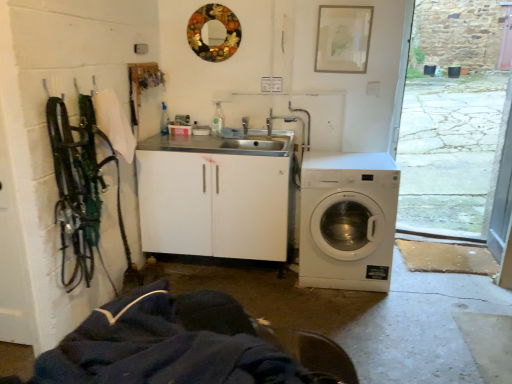
Locate an element on the screen. The image size is (512, 384). white plastic washing machine at lower right is located at coordinates (348, 220).

What do you see at coordinates (348, 220) in the screenshot? I see `white plastic washing machine at lower right` at bounding box center [348, 220].

Describe the element at coordinates (220, 22) in the screenshot. I see `metallic circular mirror at upper center` at that location.

Image resolution: width=512 pixels, height=384 pixels. What are the coordinates of `metallic circular mirror at upper center` in the screenshot? It's located at (220, 22).

Identify the location of white plastic washing machine at lower right. The width and height of the screenshot is (512, 384). (348, 220).

Between white plastic washing machine at lower right and metallic circular mirror at upper center, which one appears on the right side from the viewer's perspective?

From the viewer's perspective, white plastic washing machine at lower right appears more on the right side.

Does white plastic washing machine at lower right come behind metallic circular mirror at upper center?

That is False.

Does point (312, 239) come closer to viewer compared to point (229, 29)?

Yes, it is.

From the image's perspective, is white plastic washing machine at lower right located beneath metallic circular mirror at upper center?

Indeed, from the image's perspective, white plastic washing machine at lower right is shown beneath metallic circular mirror at upper center.

From a real-world perspective, is white plastic washing machine at lower right physically above metallic circular mirror at upper center?

No, from a real-world perspective, white plastic washing machine at lower right is not above metallic circular mirror at upper center.

In terms of width, does white plastic washing machine at lower right look wider or thinner when compared to metallic circular mirror at upper center?

white plastic washing machine at lower right is wider than metallic circular mirror at upper center.

Can you confirm if white plastic washing machine at lower right is taller than metallic circular mirror at upper center?

Correct, white plastic washing machine at lower right is much taller as metallic circular mirror at upper center.

From the picture: Which of these two, white plastic washing machine at lower right or metallic circular mirror at upper center, is smaller?

With smaller size is metallic circular mirror at upper center.

Can metallic circular mirror at upper center be found inside white plastic washing machine at lower right?

No, metallic circular mirror at upper center is located outside of white plastic washing machine at lower right.

Would you say white plastic washing machine at lower right is a long distance from metallic circular mirror at upper center?

Indeed, white plastic washing machine at lower right is not near metallic circular mirror at upper center.

Is white plastic washing machine at lower right looking in the opposite direction of metallic circular mirror at upper center?

No, white plastic washing machine at lower right is not facing away from metallic circular mirror at upper center.

How different are the orientations of white plastic washing machine at lower right and metallic circular mirror at upper center in degrees?

There is a 3.11-degree angle between the facing directions of white plastic washing machine at lower right and metallic circular mirror at upper center.

The height and width of the screenshot is (384, 512). I want to click on mirror behind the white plastic washing machine at lower right, so click(220, 22).

Visually, is metallic circular mirror at upper center positioned to the left or to the right of white plastic washing machine at lower right?

metallic circular mirror at upper center is positioned on white plastic washing machine at lower right's left side.

Which object is further away from the camera taking this photo, metallic circular mirror at upper center or white plastic washing machine at lower right?

metallic circular mirror at upper center is further from the camera.

Which is further, (198,17) or (336,248)?

The point (198,17) is more distant.

From the image's perspective, is metallic circular mirror at upper center over white plastic washing machine at lower right?

Yes.

From a real-world perspective, is metallic circular mirror at upper center physically located above or below white plastic washing machine at lower right?

In terms of real-world spatial position, metallic circular mirror at upper center is above white plastic washing machine at lower right.

Is metallic circular mirror at upper center thinner than white plastic washing machine at lower right?

Correct, the width of metallic circular mirror at upper center is less than that of white plastic washing machine at lower right.

Can you confirm if metallic circular mirror at upper center is taller than white plastic washing machine at lower right?

In fact, metallic circular mirror at upper center may be shorter than white plastic washing machine at lower right.

Can you confirm if metallic circular mirror at upper center is smaller than white plastic washing machine at lower right?

Correct, metallic circular mirror at upper center occupies less space than white plastic washing machine at lower right.

Is metallic circular mirror at upper center not inside white plastic washing machine at lower right?

Yes, metallic circular mirror at upper center is located beyond the bounds of white plastic washing machine at lower right.

Is metallic circular mirror at upper center touching white plastic washing machine at lower right?

metallic circular mirror at upper center is not next to white plastic washing machine at lower right, and they're not touching.

Consider the image. Is metallic circular mirror at upper center oriented away from white plastic washing machine at lower right?

No, white plastic washing machine at lower right is not at the back of metallic circular mirror at upper center.

Measure the distance between metallic circular mirror at upper center and white plastic washing machine at lower right.

metallic circular mirror at upper center and white plastic washing machine at lower right are 4.54 feet apart.

The width and height of the screenshot is (512, 384). What are the coordinates of `washing machine below the metallic circular mirror at upper center (from a real-world perspective)` in the screenshot? It's located at (348, 220).

Image resolution: width=512 pixels, height=384 pixels. Find the location of `mirror on the left of white plastic washing machine at lower right`. mirror on the left of white plastic washing machine at lower right is located at coordinates (220, 22).

At what (x,y) coordinates should I click in order to perform the action: click on mirror that is above the white plastic washing machine at lower right (from the image's perspective). Please return your answer as a coordinate pair (x, y). This screenshot has width=512, height=384. Looking at the image, I should click on (220, 22).